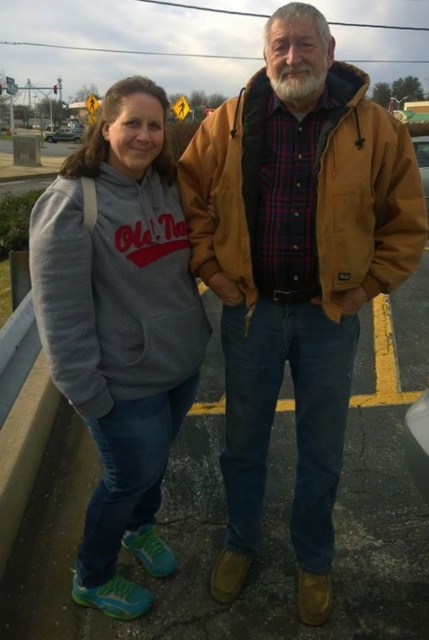
Who is shorter, gray fleece hoodie at left or silver metallic sedan at left?

Standing shorter between the two is silver metallic sedan at left.

How distant is gray fleece hoodie at left from silver metallic sedan at left?

gray fleece hoodie at left and silver metallic sedan at left are 46.07 meters apart from each other.

Does point (132, 582) lie behind point (62, 132)?

No, (132, 582) is in front of (62, 132).

Image resolution: width=429 pixels, height=640 pixels. Identify the location of gray fleece hoodie at left. (120, 326).

Is brown leather jacket at center smaller than gray fleece hoodie at left?

Incorrect, brown leather jacket at center is not smaller in size than gray fleece hoodie at left.

Between brown leather jacket at center and gray fleece hoodie at left, which one is positioned lower?

gray fleece hoodie at left

What do you see at coordinates (296, 272) in the screenshot? This screenshot has height=640, width=429. I see `brown leather jacket at center` at bounding box center [296, 272].

The width and height of the screenshot is (429, 640). I want to click on brown leather jacket at center, so [296, 272].

The image size is (429, 640). Describe the element at coordinates (296, 272) in the screenshot. I see `brown leather jacket at center` at that location.

Based on the photo, is brown leather jacket at center behind silver metallic sedan at left?

No, brown leather jacket at center is in front of silver metallic sedan at left.

Which is in front, point (329, 525) or point (72, 131)?

Point (329, 525) is in front.

Identify the location of brown leather jacket at center. (296, 272).